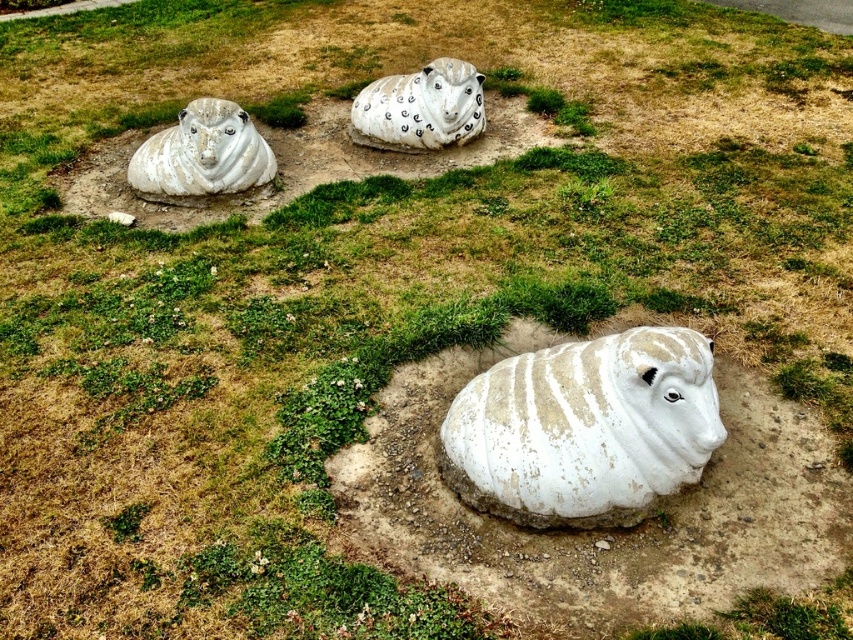
Is white textured sheep at center below white matte sheep at center?

Correct, white textured sheep at center is located below white matte sheep at center.

Does white textured sheep at center appear over white matte sheep at center?

Actually, white textured sheep at center is below white matte sheep at center.

Which is in front, point (537, 406) or point (461, 67)?

Point (537, 406) is more forward.

The width and height of the screenshot is (853, 640). In order to click on white textured sheep at center in this screenshot , I will do `click(584, 428)`.

Is white matte sheep at upper left wider than white matte sheep at center?

Incorrect, white matte sheep at upper left's width does not surpass white matte sheep at center's.

Describe the element at coordinates (202, 152) in the screenshot. Image resolution: width=853 pixels, height=640 pixels. I see `white matte sheep at upper left` at that location.

Which is behind, point (187, 164) or point (381, 106)?

Positioned behind is point (381, 106).

The width and height of the screenshot is (853, 640). I want to click on white matte sheep at upper left, so click(x=202, y=152).

Can you confirm if white textured sheep at center is positioned to the right of white matte sheep at upper left?

Indeed, white textured sheep at center is positioned on the right side of white matte sheep at upper left.

Does point (601, 372) lie in front of point (204, 147)?

Yes, it is.

The width and height of the screenshot is (853, 640). What are the coordinates of `white textured sheep at center` in the screenshot? It's located at (584, 428).